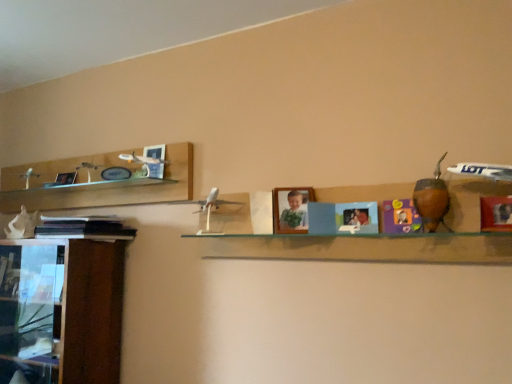
Question: Is the position of clear glass shelf at center less distant than that of white matte seashell at left, marked as the first toy in a back-to-front arrangement?

Choices:
 (A) yes
 (B) no

Answer: (A)

Question: Considering the relative sizes of clear glass shelf at center and white matte seashell at left, marked as the first toy in a back-to-front arrangement, in the image provided, is clear glass shelf at center smaller than white matte seashell at left, marked as the first toy in a back-to-front arrangement,?

Choices:
 (A) yes
 (B) no

Answer: (B)

Question: Is clear glass shelf at center directly adjacent to white matte seashell at left, which ranks as the 3th toy in right-to-left order?

Choices:
 (A) yes
 (B) no

Answer: (B)

Question: From a real-world perspective, is clear glass shelf at center physically above white matte seashell at left, marked as the first toy in a back-to-front arrangement?

Choices:
 (A) yes
 (B) no

Answer: (B)

Question: Does clear glass shelf at center appear on the left side of white matte seashell at left, acting as the first toy starting from the left?

Choices:
 (A) yes
 (B) no

Answer: (B)

Question: Is clear glass shelf at center turned away from white matte seashell at left, the third toy viewed from the front?

Choices:
 (A) no
 (B) yes

Answer: (A)

Question: From a real-world perspective, is white matte seashell at left, the third toy viewed from the front, located beneath clear glass shelf at center?

Choices:
 (A) yes
 (B) no

Answer: (B)

Question: Is white matte seashell at left, the third toy viewed from the front, to the left of clear glass shelf at center from the viewer's perspective?

Choices:
 (A) no
 (B) yes

Answer: (B)

Question: Is white matte seashell at left, which ranks as the 3th toy in right-to-left order, in front of clear glass shelf at center?

Choices:
 (A) yes
 (B) no

Answer: (B)

Question: From a real-world perspective, is white matte seashell at left, acting as the first toy starting from the left, over clear glass shelf at center?

Choices:
 (A) yes
 (B) no

Answer: (A)

Question: From the image's perspective, is white matte seashell at left, the third toy viewed from the front, below clear glass shelf at center?

Choices:
 (A) yes
 (B) no

Answer: (A)

Question: Is white matte seashell at left, acting as the first toy starting from the left, positioned behind clear glass shelf at center?

Choices:
 (A) yes
 (B) no

Answer: (A)

Question: Considering the relative sizes of matte purple toy at center, the 2th toy viewed from the right, and brown leather gourd at right, marked as the 3th toy in a left-to-right arrangement, in the image provided, is matte purple toy at center, the 2th toy viewed from the right, smaller than brown leather gourd at right, marked as the 3th toy in a left-to-right arrangement,?

Choices:
 (A) no
 (B) yes

Answer: (B)